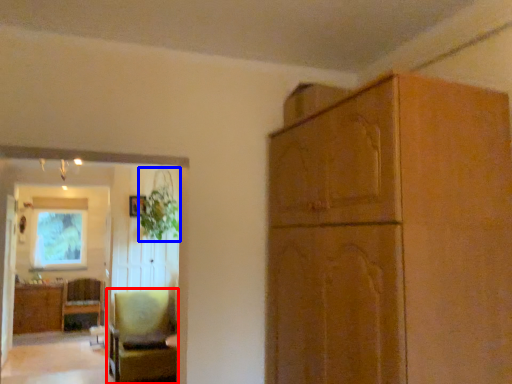
Question: Among these objects, which one is nearest to the camera, chair (highlighted by a red box) or plant (highlighted by a blue box)?

Choices:
 (A) chair
 (B) plant

Answer: (A)